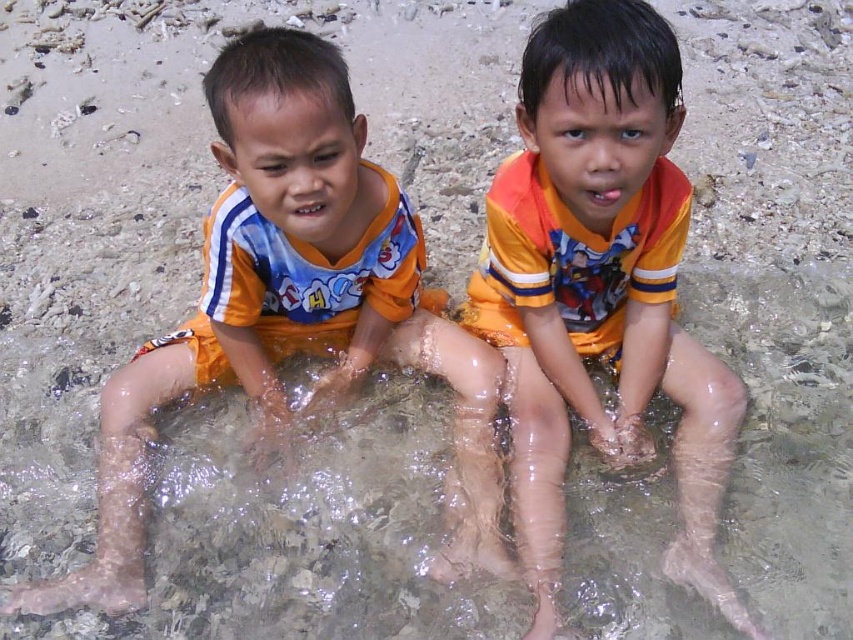
Question: Which point is closer to the camera?

Choices:
 (A) (4, 531)
 (B) (399, 289)

Answer: (A)

Question: Does orange cotton shirt at center appear over orange fabric shirt at left?

Choices:
 (A) no
 (B) yes

Answer: (A)

Question: Is orange cotton shirt at center below orange fabric shirt at left?

Choices:
 (A) yes
 (B) no

Answer: (A)

Question: Observing the image, what is the correct spatial positioning of orange cotton shirt at center in reference to orange fabric shirt at left?

Choices:
 (A) below
 (B) above

Answer: (A)

Question: Which is nearer to the orange cotton shirt at center?

Choices:
 (A) orange fabric shirt at left
 (B) clear water at legs center

Answer: (A)

Question: Among these points, which one is farthest from the camera?

Choices:
 (A) (146, 634)
 (B) (473, 422)
 (C) (532, 257)

Answer: (B)